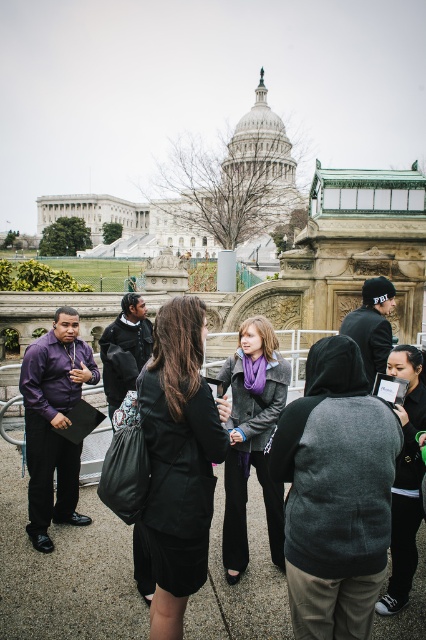
Is point (207, 474) in front of point (239, 531)?

Yes, it is.

Based on the photo, which of these two, black fabric coat at center or matte gray jacket at center, stands taller?

With more height is black fabric coat at center.

Is point (173, 605) less distant than point (262, 440)?

Yes, point (173, 605) is closer to viewer.

Locate an element on the screen. The width and height of the screenshot is (426, 640). black fabric coat at center is located at coordinates (178, 460).

Which is in front, point (282, 538) or point (409, 509)?

Point (409, 509)

Between point (221, 541) and point (406, 419), which one is positioned in front?

Point (406, 419) is in front.

Locate an element on the screen. The height and width of the screenshot is (640, 426). matte gray jacket at center is located at coordinates (253, 438).

Is black fabric coat at center further to the viewer compared to dark gray hoodie at center?

No, it is not.

Does black fabric coat at center lie in front of dark gray hoodie at center?

Yes, it is.

The width and height of the screenshot is (426, 640). I want to click on black fabric coat at center, so click(178, 460).